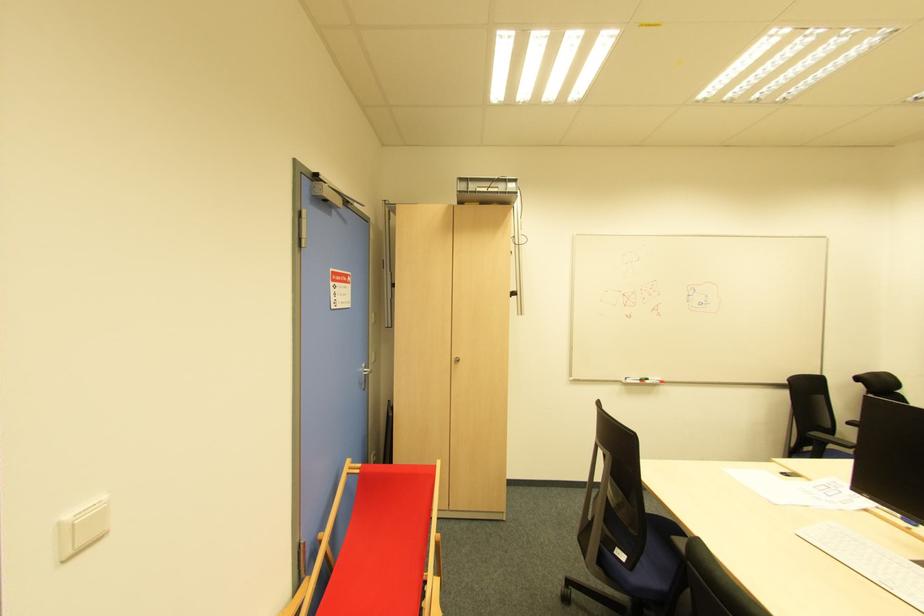
What are the coordinates of `blue chair sitting surface` in the screenshot? It's located at (655, 553).